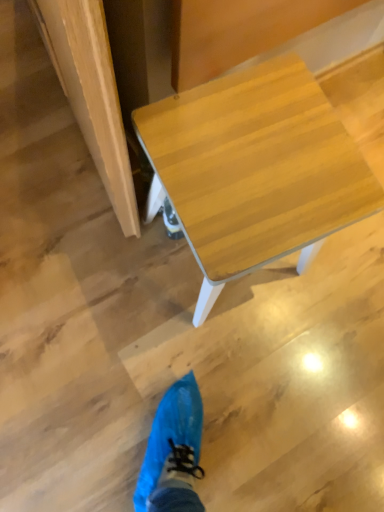
The height and width of the screenshot is (512, 384). Describe the element at coordinates (255, 168) in the screenshot. I see `light wood table at center` at that location.

I want to click on light wood table at center, so pyautogui.click(x=255, y=168).

The image size is (384, 512). In order to click on light wood table at center in this screenshot , I will do `click(255, 168)`.